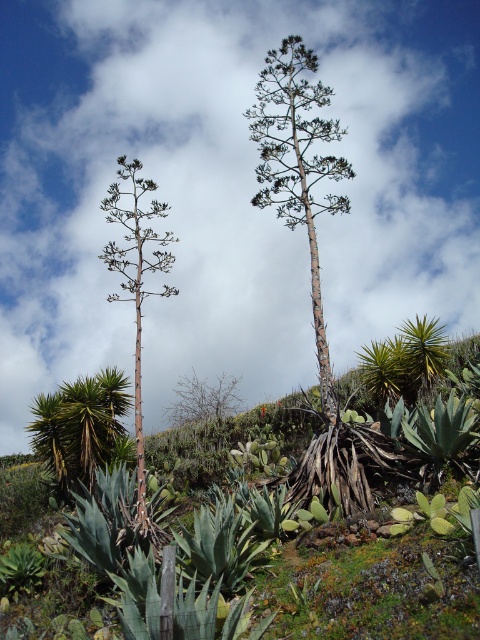
Question: Is greenish-brown bark tree at center closer to the viewer compared to green spiky plant at left?

Choices:
 (A) no
 (B) yes

Answer: (A)

Question: Estimate the real-world distances between objects in this image. Which object is closer to the green spiky plant at left?

Choices:
 (A) white fluffy cloud at upper center
 (B) greenish-brown bark tree at center

Answer: (B)

Question: Which object is closer to the camera taking this photo?

Choices:
 (A) greenish-brown bark tree at center
 (B) green spiky plant at left
 (C) white fluffy cloud at upper center

Answer: (C)

Question: Which object is farther from the camera taking this photo?

Choices:
 (A) greenish-brown bark tree at center
 (B) white fluffy cloud at upper center

Answer: (A)

Question: Does white fluffy cloud at upper center appear under greenish-brown bark tree at center?

Choices:
 (A) no
 (B) yes

Answer: (A)

Question: Can you confirm if white fluffy cloud at upper center is bigger than green spiky plant at left?

Choices:
 (A) no
 (B) yes

Answer: (B)